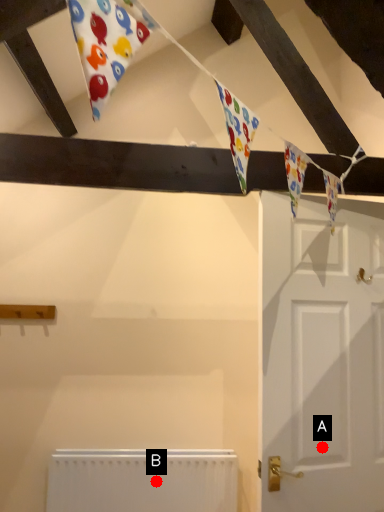
Question: Two points are circled on the image, labeled by A and B beside each circle. Which point is closer to the camera taking this photo?

Choices:
 (A) A is closer
 (B) B is closer

Answer: (A)